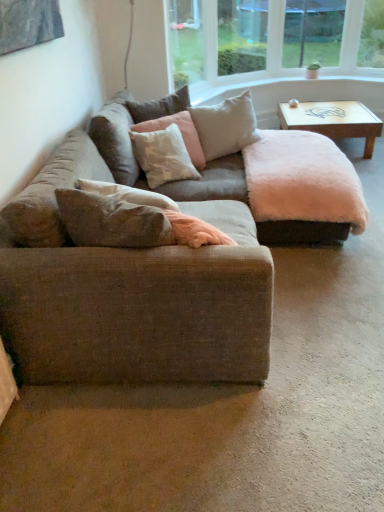
Question: Considering their positions, is clear glass window screen at upper center, arranged as the 2th window screen when viewed from the left, located in front of or behind light beige fabric pillow at center, the 3th pillow viewed from the front?

Choices:
 (A) behind
 (B) front

Answer: (A)

Question: Considering the positions of clear glass window screen at upper center, arranged as the 2th window screen when viewed from the left, and light beige fabric pillow at center, the 3th pillow viewed from the front, in the image, is clear glass window screen at upper center, arranged as the 2th window screen when viewed from the left, wider or thinner than light beige fabric pillow at center, the 3th pillow viewed from the front,?

Choices:
 (A) thin
 (B) wide

Answer: (A)

Question: Considering the real-world distances, which object is farthest from the light beige fabric pillow at center, the 3th pillow viewed from the front?

Choices:
 (A) clear glass window screen at upper center, arranged as the 2th window screen when viewed from the left
 (B) textured beige couch at center
 (C) soft beige cushion at upper center, marked as the first pillow in a back-to-front arrangement
 (D) soft beige fabric pillow at center, the fourth pillow from the back
 (E) wooden coffee table at upper right

Answer: (A)

Question: Which of these objects is positioned closest to the wooden coffee table at upper right?

Choices:
 (A) textured beige couch at center
 (B) textured beige couch at center
 (C) soft pink fabric pillow at center, positioned as the third pillow in back-to-front order
 (D) soft beige fabric pillow at center, which ranks as the first pillow in front-to-back order
 (E) light beige fabric pillow at center, the 3th pillow viewed from the front

Answer: (E)